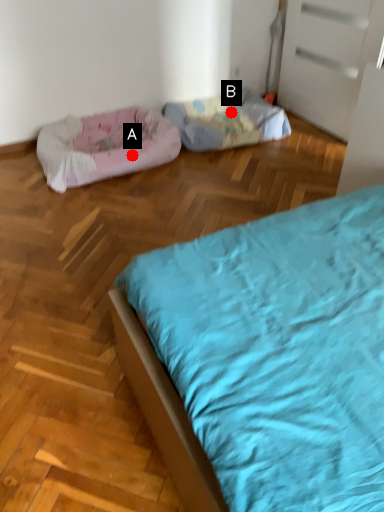
Question: Two points are circled on the image, labeled by A and B beside each circle. Which point appears closest to the camera in this image?

Choices:
 (A) A is closer
 (B) B is closer

Answer: (A)